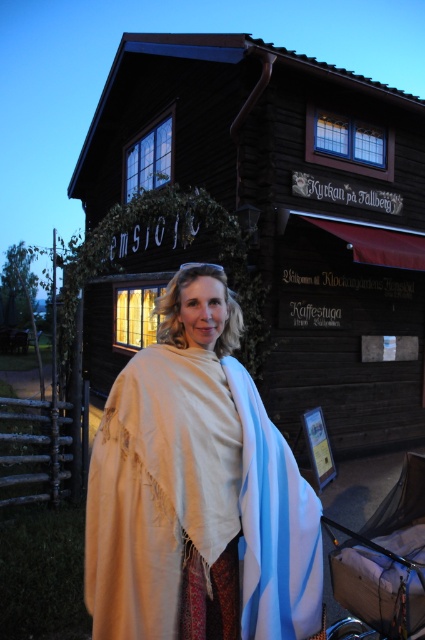
Is the position of brown wooden cabin at center less distant than that of beige wool shawl at center?

No, it is not.

Which is above, brown wooden cabin at center or beige wool shawl at center?

Positioned higher is brown wooden cabin at center.

Is point (319, 301) positioned behind point (289, 486)?

Yes, point (319, 301) is farther from viewer.

Where is `brown wooden cabin at center`? brown wooden cabin at center is located at coordinates (289, 211).

Between brown wooden cabin at center and brown fabric baby carriage at lower right, which one has more height?

brown wooden cabin at center is taller.

Which is above, brown wooden cabin at center or brown fabric baby carriage at lower right?

Positioned higher is brown wooden cabin at center.

What do you see at coordinates (289, 211) in the screenshot? Image resolution: width=425 pixels, height=640 pixels. I see `brown wooden cabin at center` at bounding box center [289, 211].

Image resolution: width=425 pixels, height=640 pixels. Identify the location of brown wooden cabin at center. (289, 211).

Can you confirm if beige wool shawl at center is positioned above brown fabric baby carriage at lower right?

Yes.

Is beige wool shawl at center to the left of brown fabric baby carriage at lower right from the viewer's perspective?

Yes, beige wool shawl at center is to the left of brown fabric baby carriage at lower right.

In order to click on beige wool shawl at center in this screenshot , I will do `click(197, 490)`.

Where is `beige wool shawl at center`? This screenshot has height=640, width=425. beige wool shawl at center is located at coordinates (197, 490).